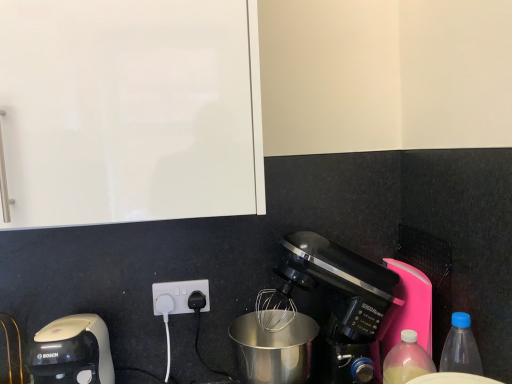
Question: Based on their positions, is translucent plastic bottle at lower right, the second bottle from the right, located to the left or right of matte black coffee maker at lower right, the second coffee maker viewed from the left?

Choices:
 (A) left
 (B) right

Answer: (B)

Question: Looking at their shapes, would you say translucent plastic bottle at lower right, the 1th bottle when ordered from left to right, is wider or thinner than matte black coffee maker at lower right, which ranks as the 1th coffee maker in right-to-left order?

Choices:
 (A) thin
 (B) wide

Answer: (A)

Question: Estimate the real-world distances between objects in this image. Which object is closer to the matte black coffee maker at lower right, which ranks as the 1th coffee maker in right-to-left order?

Choices:
 (A) black plastic power plugs and sockets at lower center
 (B) blue translucent bottle at lower right, which is counted as the 1th bottle, starting from the right
 (C) translucent plastic bottle at lower right, the second bottle from the right
 (D) white plastic coffee maker at lower left, the first coffee maker positioned from the left

Answer: (C)

Question: Which of these objects is positioned closest to the white plastic coffee maker at lower left, the first coffee maker positioned from the left?

Choices:
 (A) black plastic power plugs and sockets at lower center
 (B) matte black coffee maker at lower right, the second coffee maker viewed from the left
 (C) translucent plastic bottle at lower right, the second bottle from the right
 (D) blue translucent bottle at lower right, which is the 2th bottle in left-to-right order

Answer: (A)